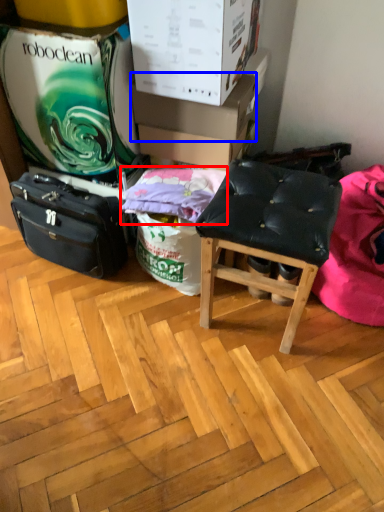
Question: Which point is further to the camera, pillow (highlighted by a red box) or cardboard box (highlighted by a blue box)?

Choices:
 (A) pillow
 (B) cardboard box

Answer: (B)